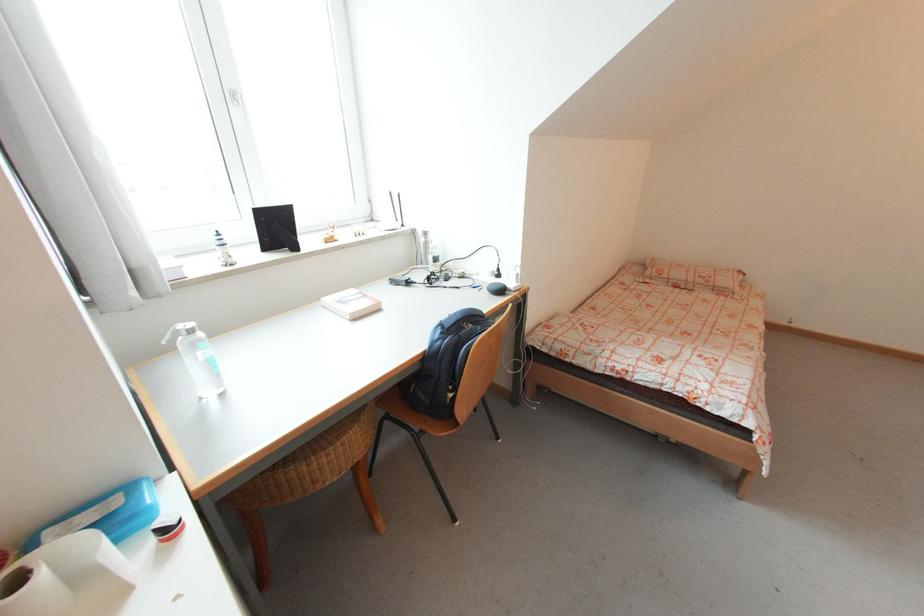
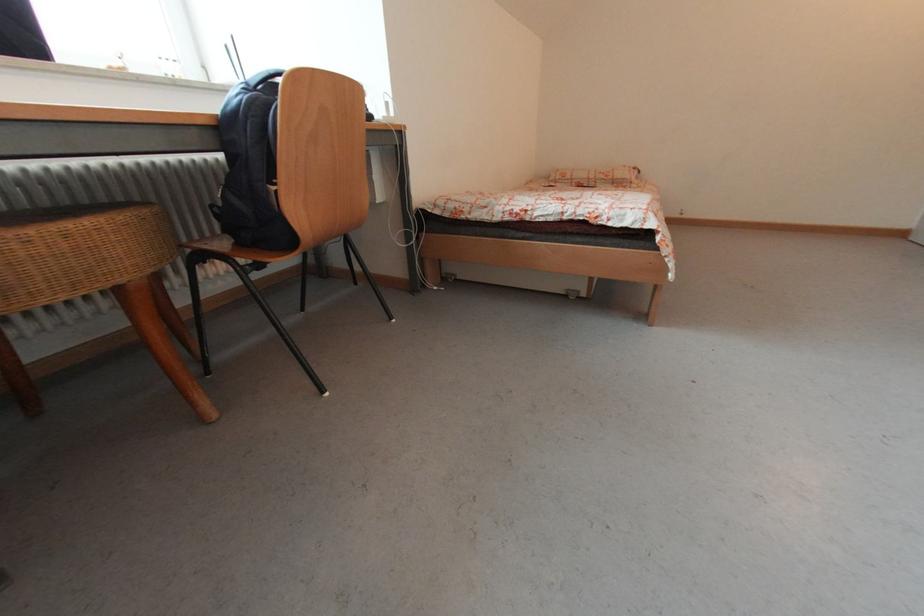
Question: The first image is from the beginning of the video and the second image is from the end. How did the camera likely rotate when shooting the video?

Choices:
 (A) Left
 (B) Right
 (C) Up
 (D) Down

Answer: (B)